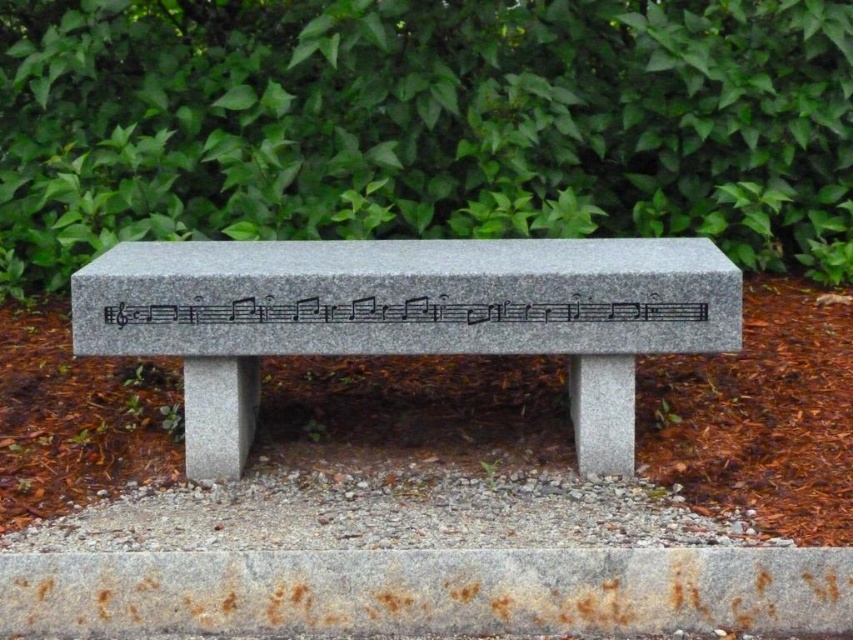
You are a gardener planning to trim the green leafy bush at upper center and the granite bench at center. Which object requires more horizontal space to work around?

The green leafy bush at upper center might be wider than the granite bench at center, so it requires more horizontal space to work around.

You are a park visitor who wants to sit on the granite bench at center. However, there is an engraving of black granite musical notes at center on the bench. Can you sit on the bench without touching the musical notes?

The granite bench at center is positioned on the right side of black granite musical notes at center. Therefore, you can sit on the left side of the bench to avoid touching the musical notes.